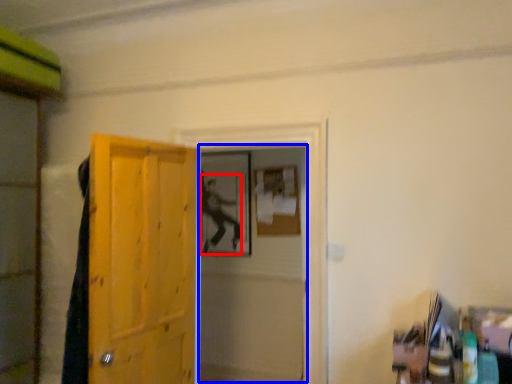
Question: Which point is further to the camera, person (highlighted by a red box) or screen door (highlighted by a blue box)?

Choices:
 (A) person
 (B) screen door

Answer: (A)